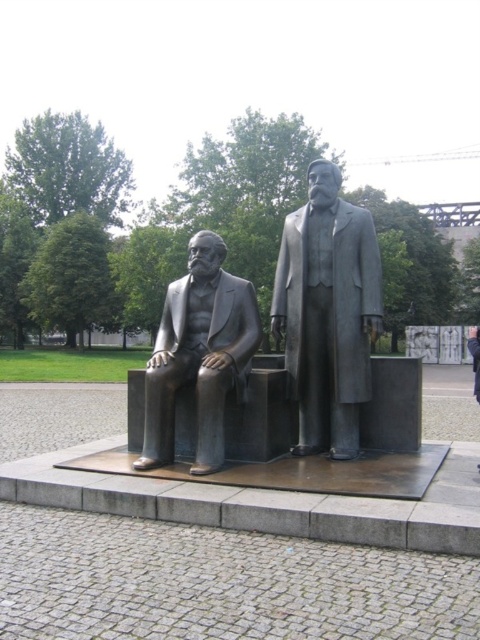
How much distance is there between polished bronze statue at center and bronze statue at center?

polished bronze statue at center is 3.45 meters from bronze statue at center.

Does point (360, 381) lie in front of point (479, 384)?

No, it is behind (479, 384).

The width and height of the screenshot is (480, 640). I want to click on polished bronze statue at center, so coord(327,312).

Can you confirm if bronze statue at left is shorter than bronze statue at center?

Indeed, bronze statue at left has a lesser height compared to bronze statue at center.

Between point (146, 426) and point (476, 355), which one is positioned behind?

Positioned behind is point (476, 355).

Locate an element on the screen. bronze statue at left is located at coordinates (199, 355).

Find the location of a particular element. The image size is (480, 640). polished bronze statue at center is located at coordinates (327, 312).